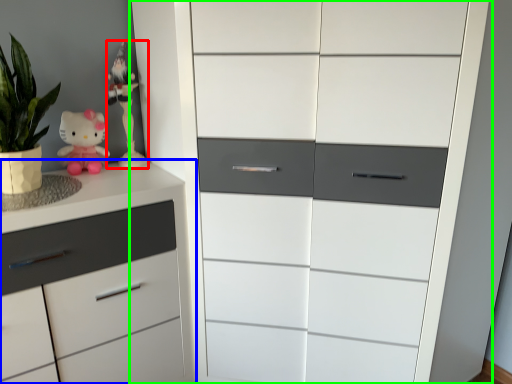
Question: Considering the real-world distances, which object is farthest from miniature (highlighted by a red box)? chest of drawers (highlighted by a blue box) or chest of drawers (highlighted by a green box)?

Choices:
 (A) chest of drawers
 (B) chest of drawers

Answer: (B)